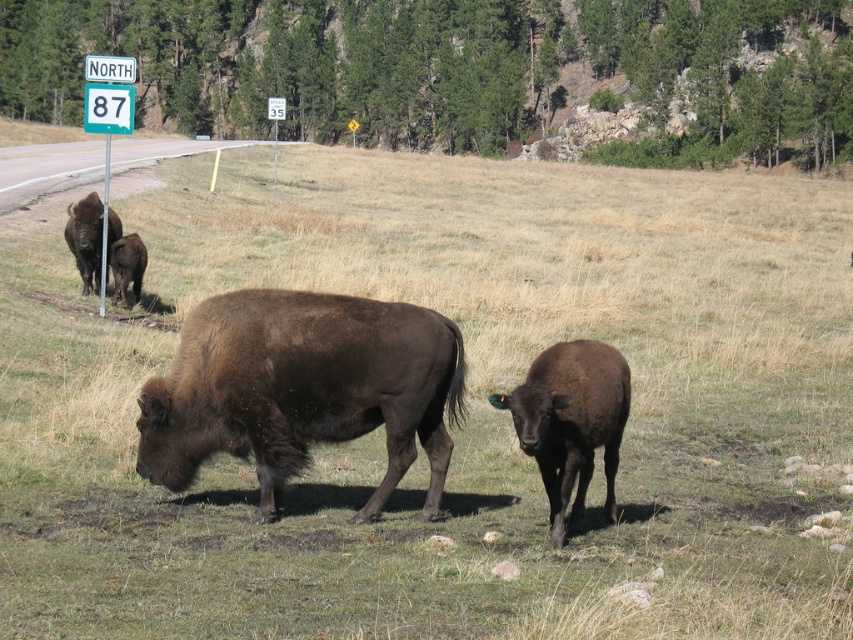
Does brushed metal sign at upper left come in front of dark brown fur at left?

No.

Between brushed metal sign at upper left and dark brown fur at left, which one has less height?

Standing shorter between the two is dark brown fur at left.

Image resolution: width=853 pixels, height=640 pixels. Find the location of `brushed metal sign at upper left`. brushed metal sign at upper left is located at coordinates (45, 170).

Where is `brushed metal sign at upper left`? brushed metal sign at upper left is located at coordinates (45, 170).

Is point (616, 161) less distant than point (100, 227)?

No, (616, 161) is behind (100, 227).

Between point (735, 74) and point (106, 244), which one is positioned behind?

Positioned behind is point (735, 74).

Does point (312, 88) come farther from viewer compared to point (90, 200)?

Yes, point (312, 88) is farther from viewer.

Locate an element on the screen. The height and width of the screenshot is (640, 853). green grass at upper center is located at coordinates (463, 74).

Between brown furry buffalo at center and green plastic sign at upper left, which one is positioned lower?

brown furry buffalo at center is lower down.

You are a GUI agent. You are given a task and a screenshot of the screen. Output one action in this format:
    pyautogui.click(x=<x>, y=<y>)
    Task: Click on the brown furry buffalo at center
    
    Given the screenshot: What is the action you would take?
    pyautogui.click(x=303, y=388)

I want to click on brown furry buffalo at center, so click(303, 388).